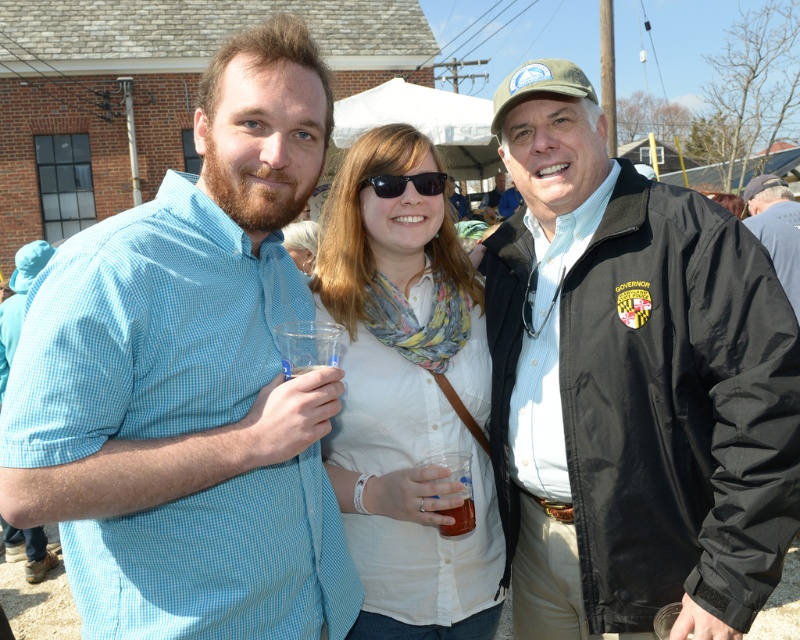
Where is `light blue checkered shirt at left`? The image size is (800, 640). light blue checkered shirt at left is located at coordinates (190, 381).

Identify the location of light blue checkered shirt at left. (190, 381).

Can you confirm if white woven shirt at center is taller than black plastic sunglasses at center?

Correct, white woven shirt at center is much taller as black plastic sunglasses at center.

Is white woven shirt at center bigger than black plastic sunglasses at center?

Correct, white woven shirt at center is larger in size than black plastic sunglasses at center.

Identify the location of white woven shirt at center. (408, 397).

This screenshot has width=800, height=640. I want to click on white woven shirt at center, so click(x=408, y=397).

Is light blue checkered shirt at left positioned behind translucent plastic cup at center?

That is False.

Does point (262, 42) come farther from viewer compared to point (460, 524)?

That is False.

Locate an element on the screen. The width and height of the screenshot is (800, 640). light blue checkered shirt at left is located at coordinates (190, 381).